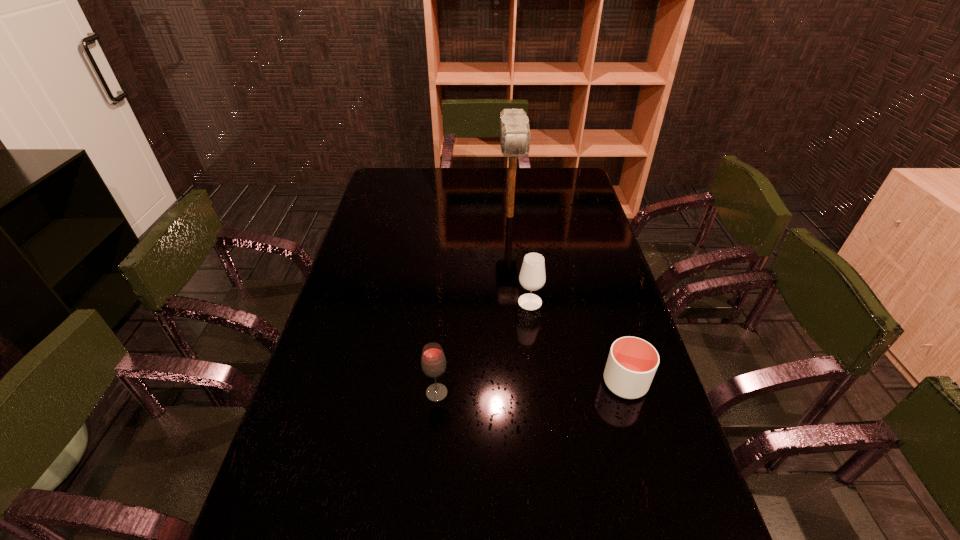
Find the location of `the tallest object`. the tallest object is located at coordinates (515, 134).

Identify the location of mallet. The image size is (960, 540). (515, 134).

You are a GUI agent. You are given a task and a screenshot of the screen. Output one action in this format:
    pyautogui.click(x=<x>, y=<y>)
    Task: Click on the second farthest object
    
    Given the screenshot: What is the action you would take?
    pyautogui.click(x=532, y=277)

Image resolution: width=960 pixels, height=540 pixels. In order to click on the right glass drink container in this screenshot , I will do `click(532, 277)`.

Locate an element on the screen. Image resolution: width=960 pixels, height=540 pixels. the leftmost object is located at coordinates (433, 362).

The image size is (960, 540). I want to click on the left glass drink container, so click(x=433, y=362).

You are a GUI agent. You are given a task and a screenshot of the screen. Output one action in this format:
    pyautogui.click(x=<x>, y=<y>)
    Task: Click on the cup
    Image resolution: width=960 pixels, height=540 pixels.
    Given the screenshot: What is the action you would take?
    point(632,362)

The image size is (960, 540). Find the location of `the rightmost object`. the rightmost object is located at coordinates (632, 362).

The image size is (960, 540). Identify the location of vacant point located 0.230m on the striking face of the tallest object. (515, 269).

Where is `free space located on the left of the farther glass drink container`? free space located on the left of the farther glass drink container is located at coordinates (399, 302).